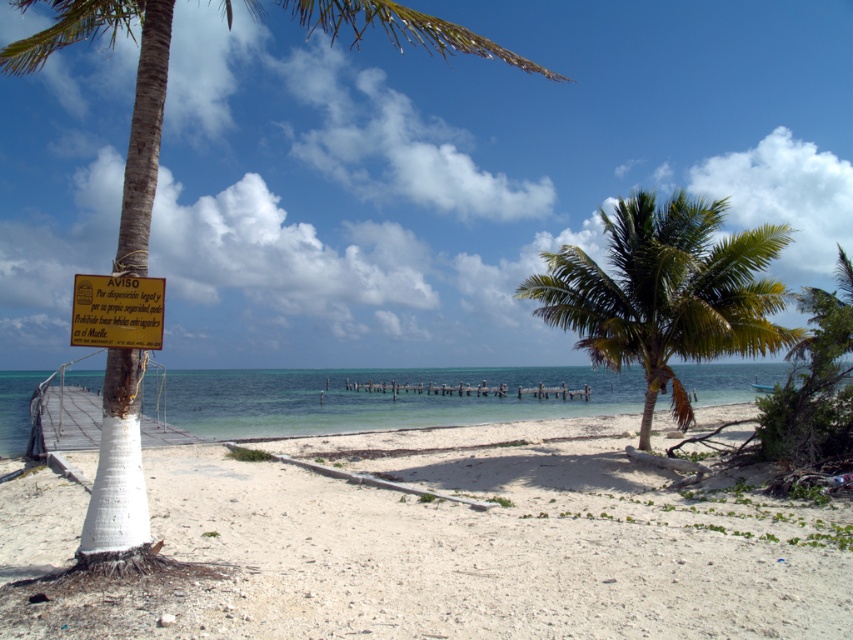
Question: Does white sand beach at lower left have a smaller size compared to clear blue water at center?

Choices:
 (A) yes
 (B) no

Answer: (A)

Question: In this image, where is white sand beach at lower left located relative to green leafy palm tree at center?

Choices:
 (A) left
 (B) right

Answer: (A)

Question: Which object appears farthest from the camera in this image?

Choices:
 (A) matte yellow sign at upper left
 (B) clear blue water at center
 (C) green leafy palm tree at center
 (D) white sand beach at lower left

Answer: (B)

Question: Is green leafy palm tree at center wider than clear blue water at center?

Choices:
 (A) no
 (B) yes

Answer: (A)

Question: Which point is closer to the camera?

Choices:
 (A) (395, 547)
 (B) (86, 557)
 (C) (107, 330)

Answer: (B)

Question: Estimate the real-world distances between objects in this image. Which object is farther from the white sand beach at lower left?

Choices:
 (A) green leafy palm tree at left
 (B) clear blue water at center

Answer: (B)